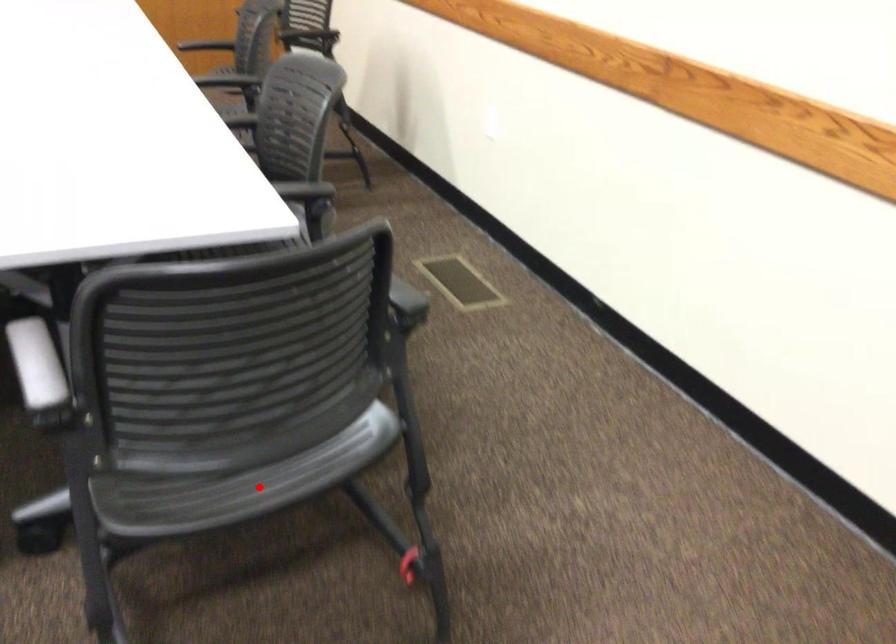
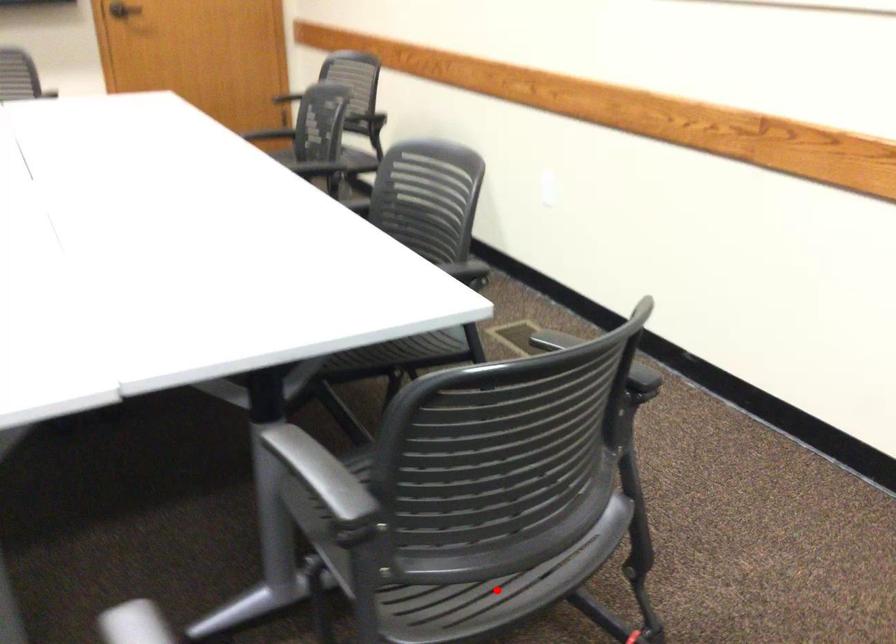
I am providing you with two images of the same scene from different viewpoints. A red point is marked on the first image and another point is marked on the second image. Does the point marked in image1 correspond to the same location as the one in image2?

Yes